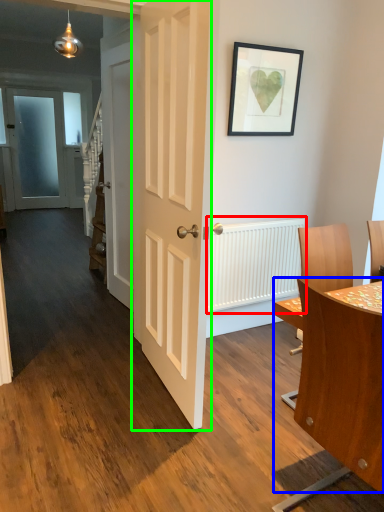
Question: Which is nearer to the radiator (highlighted by a red box)? table (highlighted by a blue box) or door (highlighted by a green box).

Choices:
 (A) table
 (B) door

Answer: (B)